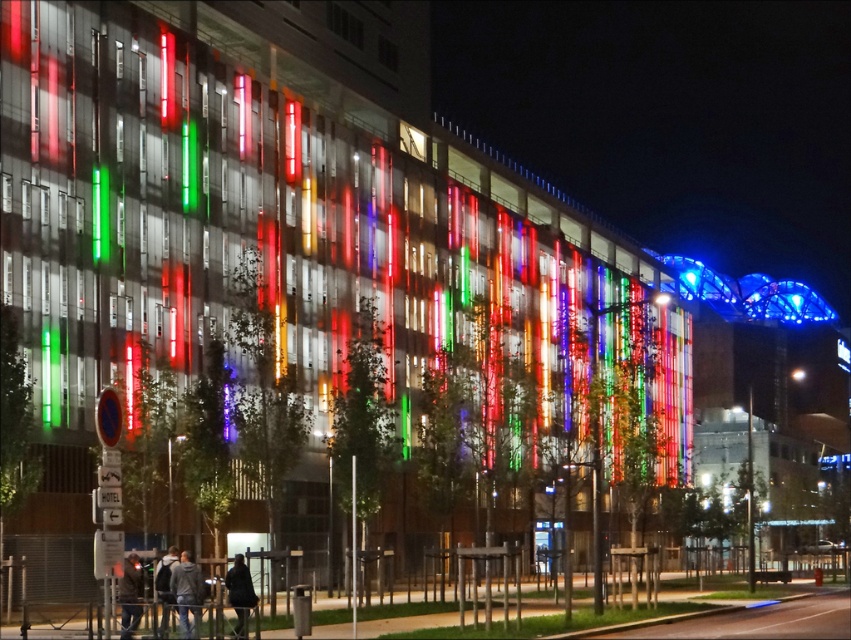
Can you confirm if gray fabric jacket at lower center is positioned above dark gray jacket at lower left?

Yes.

Can you confirm if gray fabric jacket at lower center is wider than dark gray jacket at lower left?

In fact, gray fabric jacket at lower center might be narrower than dark gray jacket at lower left.

Locate an element on the screen. gray fabric jacket at lower center is located at coordinates (187, 593).

I want to click on gray fabric jacket at lower center, so click(x=187, y=593).

Is gray fabric jacket at lower center taller than black fabric coat at lower center?

Correct, gray fabric jacket at lower center is much taller as black fabric coat at lower center.

Can you confirm if gray fabric jacket at lower center is positioned to the left of black fabric coat at lower center?

Yes, gray fabric jacket at lower center is to the left of black fabric coat at lower center.

Is point (193, 582) positioned in front of point (241, 573)?

Yes.

What are the coordinates of `gray fabric jacket at lower center` in the screenshot? It's located at (187, 593).

Does dark gray jacket at lower left have a lesser width compared to black fabric coat at lower center?

No, dark gray jacket at lower left is not thinner than black fabric coat at lower center.

Is dark gray jacket at lower left shorter than black fabric coat at lower center?

No.

Which is behind, point (129, 589) or point (238, 557)?

The point (238, 557) is behind.

Where is `dark gray jacket at lower left`? This screenshot has height=640, width=851. dark gray jacket at lower left is located at coordinates click(130, 595).